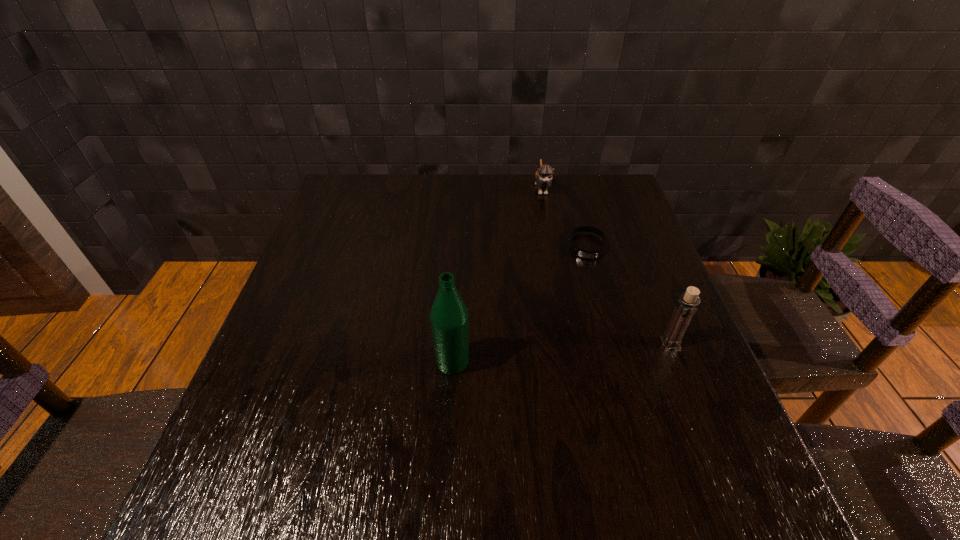
You are a GUI agent. You are given a task and a screenshot of the screen. Output one action in this format:
    pyautogui.click(x=<x>, y=<y>)
    Task: Click on the empty location between the kitten and the second farthest object
    The height and width of the screenshot is (540, 960).
    Given the screenshot: What is the action you would take?
    pyautogui.click(x=564, y=217)

The height and width of the screenshot is (540, 960). I want to click on free space that is in between the third shortest object and the farthest object, so click(606, 266).

Locate an element on the screen. Image resolution: width=960 pixels, height=540 pixels. free area in between the leftmost object and the third nearest object is located at coordinates (520, 304).

Where is `free space that is in between the candle holder and the tallest object`? The image size is (960, 540). free space that is in between the candle holder and the tallest object is located at coordinates (562, 353).

Identify the location of object that is the closest to the wristband. (543, 177).

Identify which object is the second closest to the shortest object. Please provide its 2D coordinates. Your answer should be formatted as a tuple, i.e. [(x, y)], where the tuple contains the x and y coordinates of a point satisfying the conditions above.

[(686, 306)]

Where is `vacant area that satisfies the following two spatial constraints: 1. on the front side of the farthest object; 2. on the right side of the third nearest object`? The image size is (960, 540). vacant area that satisfies the following two spatial constraints: 1. on the front side of the farthest object; 2. on the right side of the third nearest object is located at coordinates (553, 246).

Locate an element on the screen. This screenshot has width=960, height=540. vacant region that satisfies the following two spatial constraints: 1. on the back side of the third shortest object; 2. on the left side of the bottle is located at coordinates (453, 343).

I want to click on vacant space that satisfies the following two spatial constraints: 1. on the back side of the leftmost object; 2. on the right side of the candle holder, so click(453, 343).